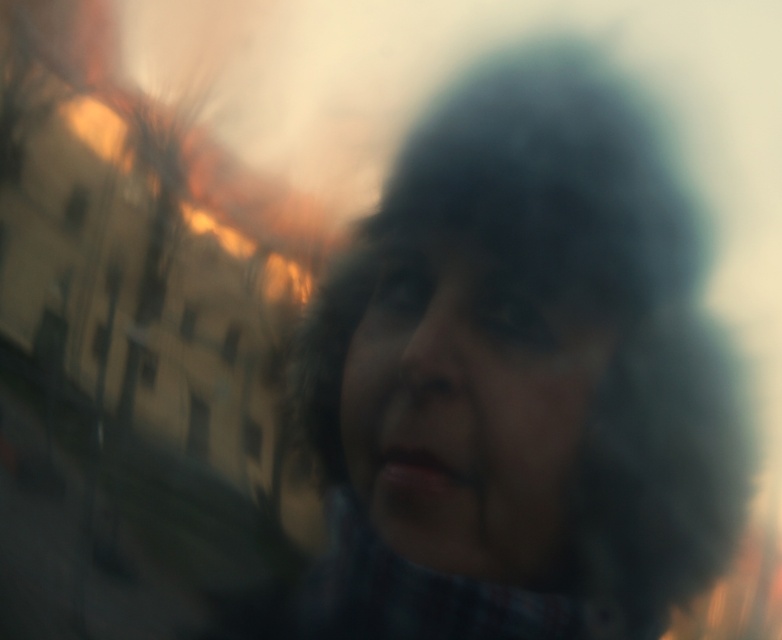
Question: Among these points, which one is nearest to the camera?

Choices:
 (A) (543, 403)
 (B) (472, 493)

Answer: (B)

Question: Which object appears closest to the camera in this image?

Choices:
 (A) dark hair at center
 (B) smooth skin face at center

Answer: (B)

Question: Can you confirm if dark hair at center is positioned above smooth skin face at center?

Choices:
 (A) no
 (B) yes

Answer: (A)

Question: Considering the relative positions of dark hair at center and smooth skin face at center in the image provided, where is dark hair at center located with respect to smooth skin face at center?

Choices:
 (A) right
 (B) left

Answer: (A)

Question: Which object appears farthest from the camera in this image?

Choices:
 (A) dark hair at center
 (B) smooth skin face at center

Answer: (A)

Question: Is dark hair at center smaller than smooth skin face at center?

Choices:
 (A) no
 (B) yes

Answer: (A)